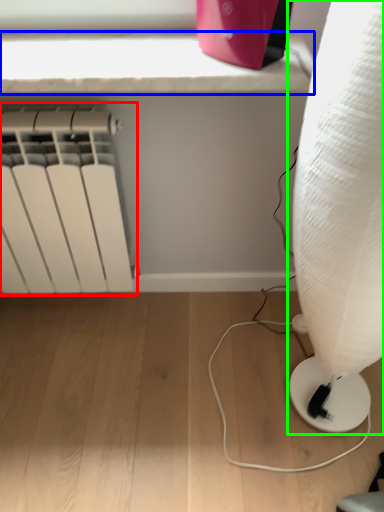
Question: Which object is positioned closest to radiator (highlighted by a red box)? Select from window sill (highlighted by a blue box) and lamp (highlighted by a green box).

Choices:
 (A) window sill
 (B) lamp

Answer: (A)